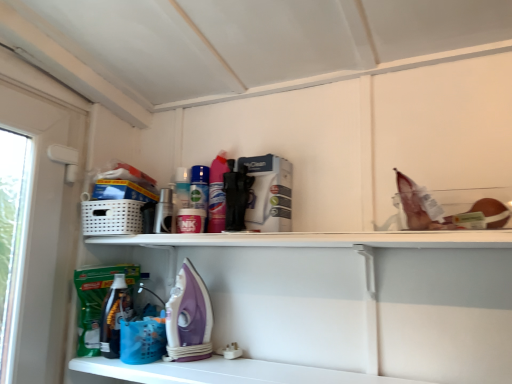
The height and width of the screenshot is (384, 512). I want to click on vacant area that is in front of blue plastic basket at lower center, so click(x=140, y=370).